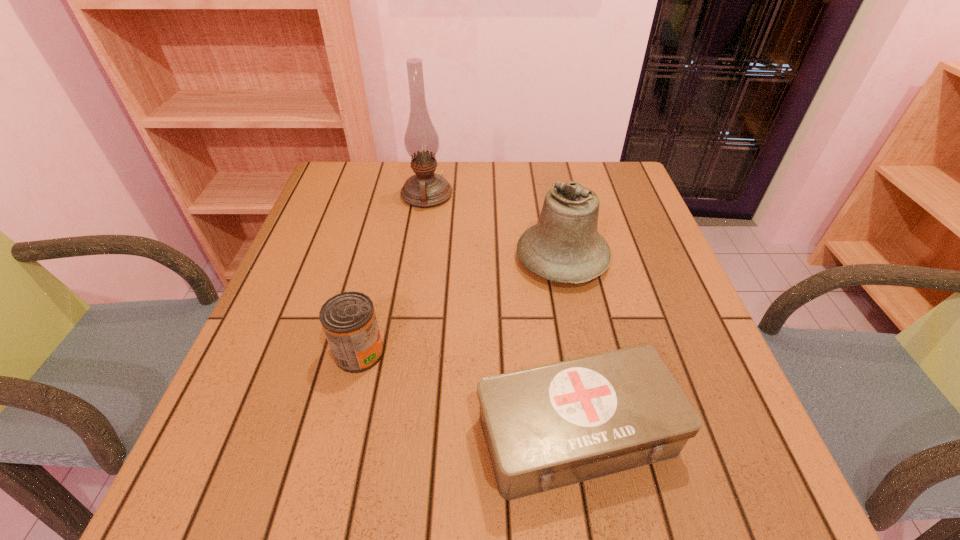
Find the location of a particular element. vacant point at the right edge is located at coordinates (638, 227).

Locate an element on the screen. The height and width of the screenshot is (540, 960). vacant space at the far left corner of the desktop is located at coordinates [x=332, y=166].

In the image, there is a desktop. Identify the location of vacant space at the near right corner. (723, 491).

Where is `empty space that is in between the first-aid kit and the second shortest object`? The width and height of the screenshot is (960, 540). empty space that is in between the first-aid kit and the second shortest object is located at coordinates (468, 393).

At what (x,y) coordinates should I click in order to perform the action: click on vacant space in between the farthest object and the first-aid kit. Please return your answer as a coordinate pair (x, y). The width and height of the screenshot is (960, 540). Looking at the image, I should click on (502, 314).

Image resolution: width=960 pixels, height=540 pixels. I want to click on empty space that is in between the farthest object and the second farthest object, so click(x=494, y=227).

The height and width of the screenshot is (540, 960). What are the coordinates of `empty space that is in between the nearest object and the third farthest object` in the screenshot? It's located at (468, 393).

Locate an element on the screen. This screenshot has width=960, height=540. free space between the tallest object and the third farthest object is located at coordinates (393, 274).

Where is `vacant region between the shortest object and the second farthest object`? This screenshot has width=960, height=540. vacant region between the shortest object and the second farthest object is located at coordinates (569, 346).

Locate an element on the screen. vacant space in between the third farthest object and the oil lamp is located at coordinates (393, 274).